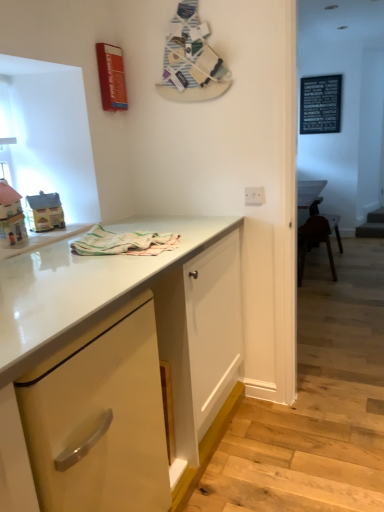
This screenshot has width=384, height=512. In order to click on vacant area on top of matte yellow cabinet at center, the second cabinetry when ordered from back to front (from a real-world perspective) in this screenshot , I will do 86,263.